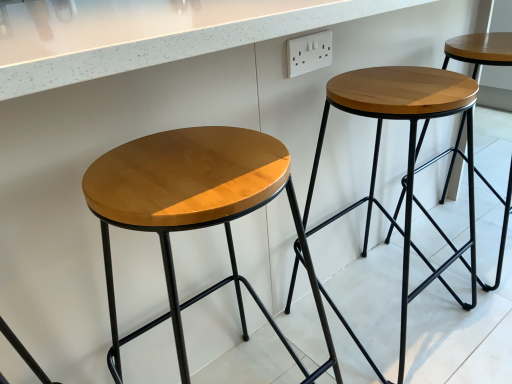
Find the location of a particular element. Image resolution: width=512 pixels, height=384 pixels. vacant region to the right of white plastic outlet at upper center is located at coordinates (396, 79).